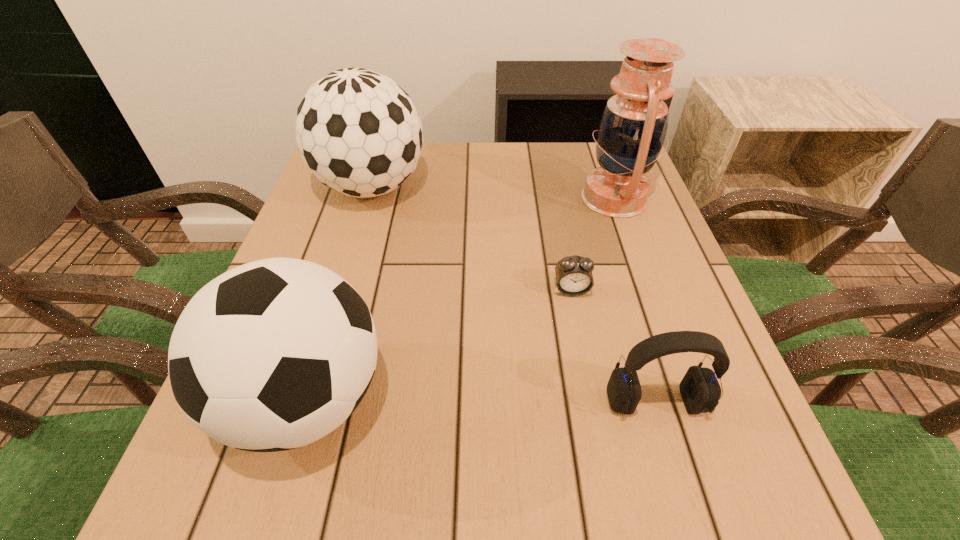
At what (x,y) coordinates should I click in order to perform the action: click on vacant space at the near edge. Please return your answer as a coordinate pair (x, y). The image size is (960, 540). Looking at the image, I should click on (470, 489).

Find the location of a particular element. The image size is (960, 540). vacant region at the left edge of the desktop is located at coordinates click(330, 202).

In the image, there is a desktop. Where is `blank space at the right edge`? The height and width of the screenshot is (540, 960). blank space at the right edge is located at coordinates (649, 245).

Locate an element on the screen. This screenshot has width=960, height=540. vacant space at the far left corner of the desktop is located at coordinates (315, 189).

Image resolution: width=960 pixels, height=540 pixels. I want to click on vacant space at the far right corner, so click(x=582, y=147).

Locate an element on the screen. The width and height of the screenshot is (960, 540). vacant area at the near right corner of the desktop is located at coordinates (733, 458).

You are a GUI agent. You are given a task and a screenshot of the screen. Output one action in this format:
    pyautogui.click(x=<x>, y=<y>)
    Task: Click on the free area in between the farther soccer ball and the alarm clock
    The width and height of the screenshot is (960, 540).
    Given the screenshot: What is the action you would take?
    pyautogui.click(x=471, y=239)

Identify the location of vacant area that lies between the farther soccer ball and the tallest object. (493, 193).

Locate an element on the screen. vacant point located between the headset and the tallest object is located at coordinates (635, 300).

Where is `free space between the nearer soccer ball and the alarm clock`? free space between the nearer soccer ball and the alarm clock is located at coordinates (439, 344).